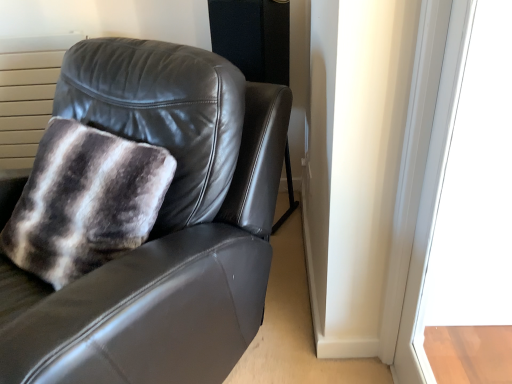
Question: Based on their sizes in the image, would you say transparent glass door at upper right is bigger or smaller than matte black leather chair at upper left?

Choices:
 (A) small
 (B) big

Answer: (A)

Question: Looking at their shapes, would you say transparent glass door at upper right is wider or thinner than matte black leather chair at upper left?

Choices:
 (A) thin
 (B) wide

Answer: (A)

Question: From a real-world perspective, relative to matte black leather chair at upper left, is transparent glass door at upper right vertically above or below?

Choices:
 (A) below
 (B) above

Answer: (B)

Question: Visually, is matte black leather chair at upper left positioned to the left or to the right of transparent glass door at upper right?

Choices:
 (A) right
 (B) left

Answer: (B)

Question: From the image's perspective, is matte black leather chair at upper left located above or below transparent glass door at upper right?

Choices:
 (A) below
 (B) above

Answer: (B)

Question: Considering their positions, is matte black leather chair at upper left located in front of or behind transparent glass door at upper right?

Choices:
 (A) behind
 (B) front

Answer: (A)

Question: Considering the positions of matte black leather chair at upper left and transparent glass door at upper right in the image, is matte black leather chair at upper left wider or thinner than transparent glass door at upper right?

Choices:
 (A) thin
 (B) wide

Answer: (B)